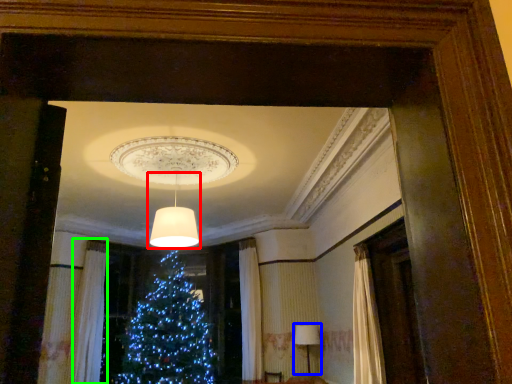
Question: Based on their relative distances, which object is farther from lamp (highlighted by a red box)? Choose from lamp (highlighted by a blue box) and curtain (highlighted by a green box).

Choices:
 (A) lamp
 (B) curtain

Answer: (B)